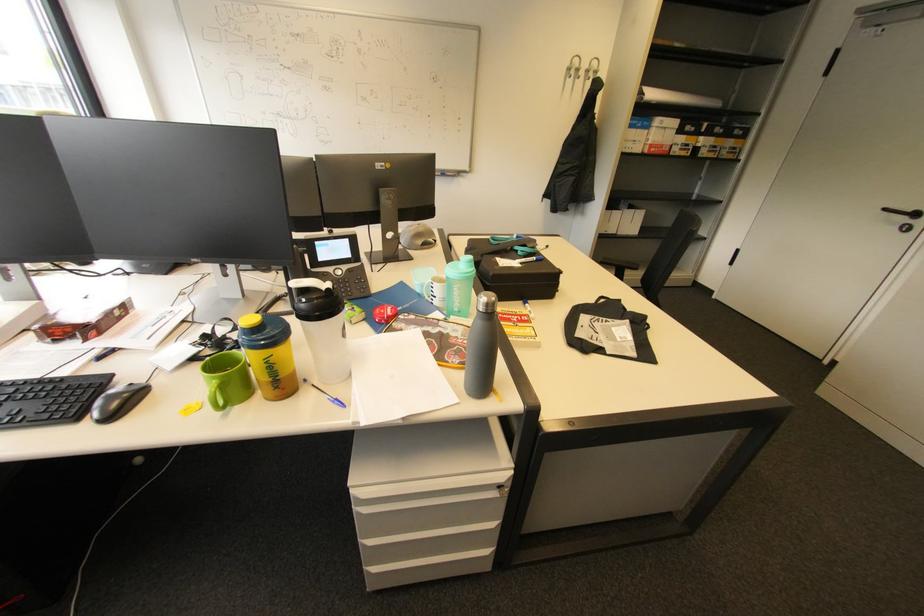
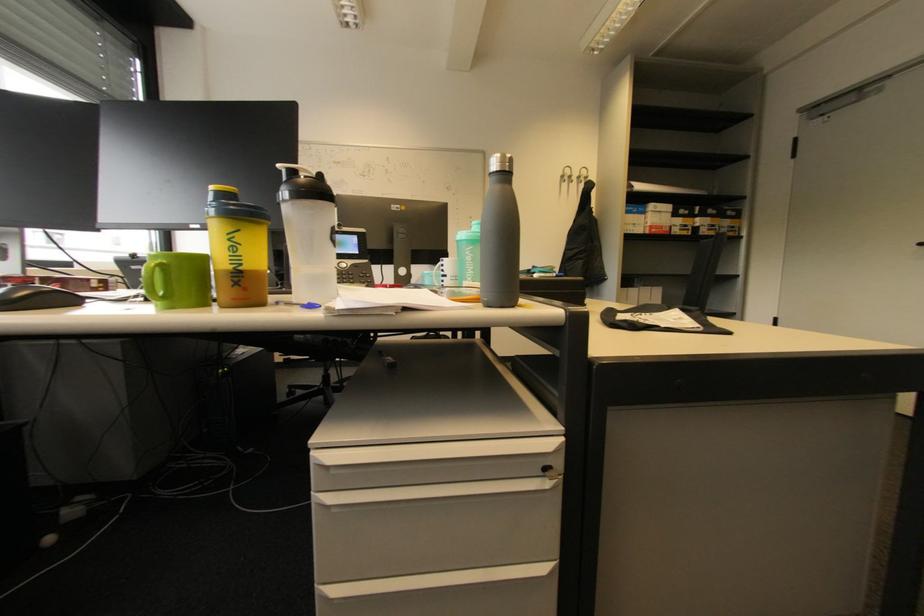
The point at (459, 290) is marked in the first image. Where is the corresponding point in the second image?

(472, 254)